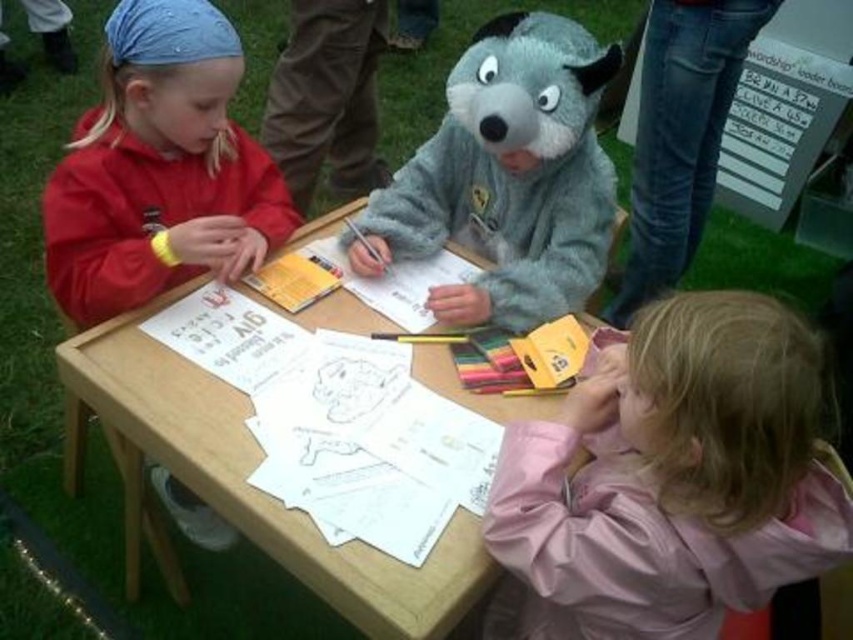
From the picture: Who is more forward, (450, 125) or (428, 602)?

Point (428, 602)

Who is more distant from viewer, (457, 170) or (109, 426)?

The point (457, 170) is behind.

Where is `fuzzy gray costume at center`? Image resolution: width=853 pixels, height=640 pixels. fuzzy gray costume at center is located at coordinates (506, 177).

Can you confirm if pink fabric jacket at lower right is smaller than fuzzy gray costume at center?

No.

Looking at this image, who is lower down, pink fabric jacket at lower right or fuzzy gray costume at center?

pink fabric jacket at lower right is lower down.

Which is behind, point (724, 534) or point (473, 148)?

Positioned behind is point (473, 148).

Locate an element on the screen. This screenshot has width=853, height=640. pink fabric jacket at lower right is located at coordinates (672, 477).

Does matte red hoodie at left appear on the right side of fuzzy gray costume at center?

Incorrect, matte red hoodie at left is not on the right side of fuzzy gray costume at center.

Looking at this image, does matte red hoodie at left have a lesser height compared to fuzzy gray costume at center?

Yes, matte red hoodie at left is shorter than fuzzy gray costume at center.

Is point (270, 202) less distant than point (570, 248)?

No.

The width and height of the screenshot is (853, 640). I want to click on matte red hoodie at left, so click(160, 168).